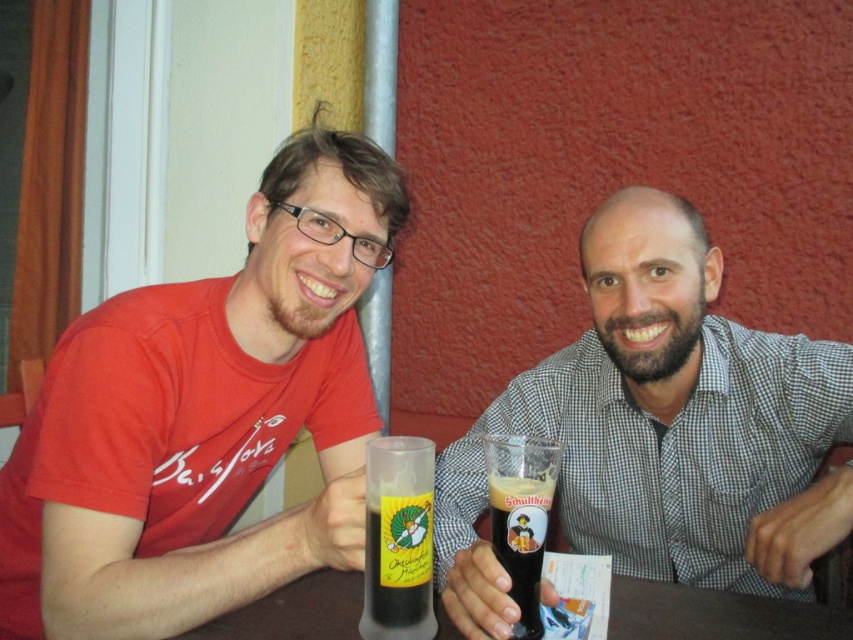
Is matte glass beer at center smaller than translucent glass bottle at center?

No, matte glass beer at center is not smaller than translucent glass bottle at center.

Does matte glass beer at center have a larger size compared to translucent glass bottle at center?

Yes, matte glass beer at center is bigger than translucent glass bottle at center.

Where is `matte glass beer at center`? matte glass beer at center is located at coordinates (662, 429).

Locate an element on the screen. This screenshot has width=853, height=640. matte glass beer at center is located at coordinates (662, 429).

Between matte plastic cup at center and matte glass beer at center, which one has less height?

With less height is matte glass beer at center.

Does matte plastic cup at center appear under matte glass beer at center?

Incorrect, matte plastic cup at center is not positioned below matte glass beer at center.

You are a GUI agent. You are given a task and a screenshot of the screen. Output one action in this format:
    pyautogui.click(x=<x>, y=<y>)
    Task: Click on the matte plastic cup at center
    This screenshot has height=640, width=853.
    Given the screenshot: What is the action you would take?
    pyautogui.click(x=206, y=417)

Where is `matte plastic cup at center`? Image resolution: width=853 pixels, height=640 pixels. matte plastic cup at center is located at coordinates (206, 417).

Who is positioned more to the left, matte plastic cup at center or translucent plastic table at center?

Positioned to the left is matte plastic cup at center.

Between point (282, 330) and point (334, 612), which one is positioned in front?

Point (334, 612) is in front.

Identify the location of matte plastic cup at center. coord(206,417).